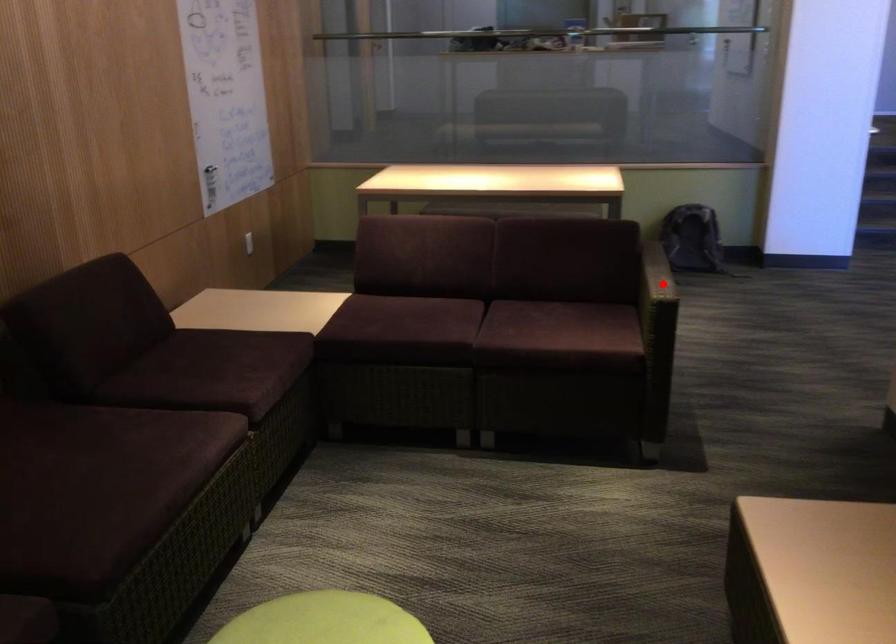
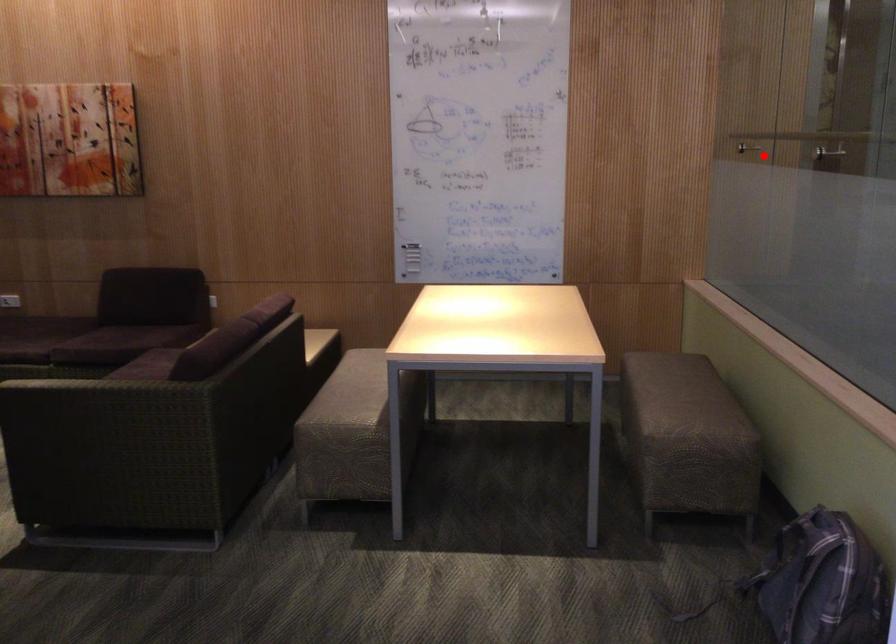
I am providing you with two images of the same scene from different viewpoints. A red point is marked on the first image and another point is marked on the second image. Is the red point in image1 aligned with the point shown in image2?

No